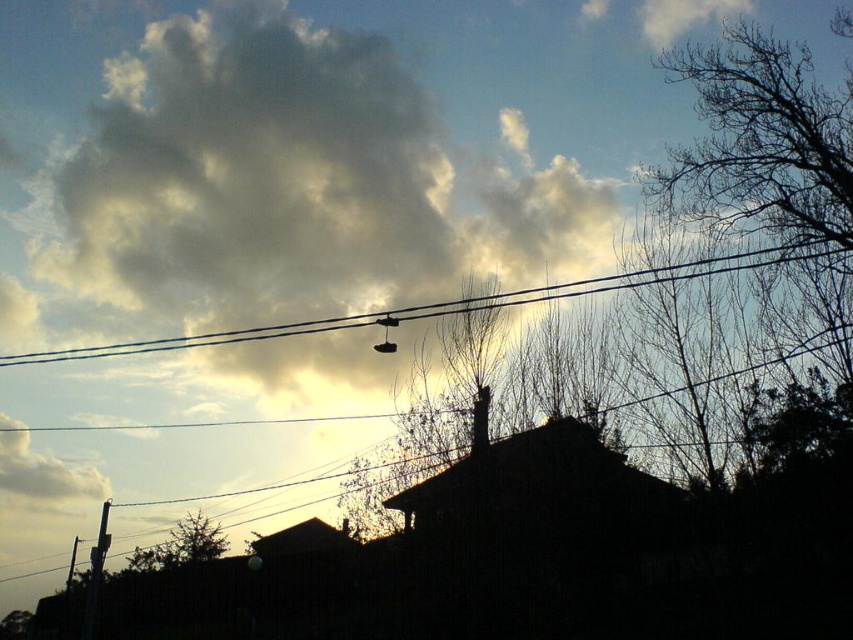
Question: Which point is closer to the camera?

Choices:
 (A) black wire at center
 (B) white fluffy cloud at upper left

Answer: (A)

Question: In this image, where is black wire at center located relative to white fluffy cloud at upper left?

Choices:
 (A) below
 (B) above

Answer: (B)

Question: Can you confirm if black wire at center is bigger than white fluffy cloud at upper left?

Choices:
 (A) no
 (B) yes

Answer: (B)

Question: Which point is farther to the camera?

Choices:
 (A) (476, 308)
 (B) (18, 456)

Answer: (B)

Question: Can you confirm if black wire at center is thinner than white fluffy cloud at upper left?

Choices:
 (A) no
 (B) yes

Answer: (A)

Question: Which point is closer to the camera?

Choices:
 (A) (78, 481)
 (B) (306, 323)

Answer: (B)